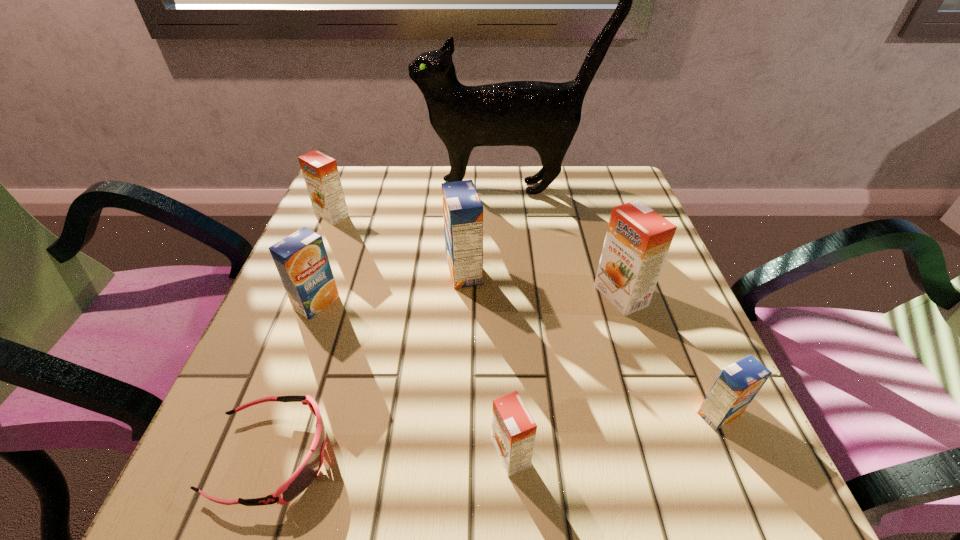
This screenshot has width=960, height=540. In order to click on object at the far left corner in this screenshot , I will do `click(320, 172)`.

At what (x,y) coordinates should I click in order to perform the action: click on object that is at the near left corner. Please return your answer as a coordinate pair (x, y). The width and height of the screenshot is (960, 540). Looking at the image, I should click on (304, 475).

Identify the location of object that is positioned at the far right corner. The image size is (960, 540). (543, 115).

The width and height of the screenshot is (960, 540). What are the coordinates of `free space at the far edge of the desktop` in the screenshot? It's located at (395, 210).

The image size is (960, 540). In the image, there is a desktop. In order to click on vacant space at the near edge in this screenshot , I will do `click(324, 454)`.

Locate an element on the screen. The image size is (960, 540). free space at the left edge is located at coordinates (308, 227).

You are a GUI agent. You are given a task and a screenshot of the screen. Output one action in this format:
    pyautogui.click(x=<x>, y=<y>)
    Task: Click on the vacant space at the right edge of the desktop
    The image size is (960, 540).
    Given the screenshot: What is the action you would take?
    pyautogui.click(x=598, y=294)

The width and height of the screenshot is (960, 540). In the image, there is a desktop. What are the coordinates of `vacant space at the far left corner` in the screenshot? It's located at (347, 219).

In order to click on vacant region at the near left corner in this screenshot , I will do `click(181, 502)`.

At what (x,y) coordinates should I click in order to perform the action: click on vacant space at the far right corner. Please return your answer as a coordinate pair (x, y). This screenshot has height=540, width=960. Looking at the image, I should click on (608, 214).